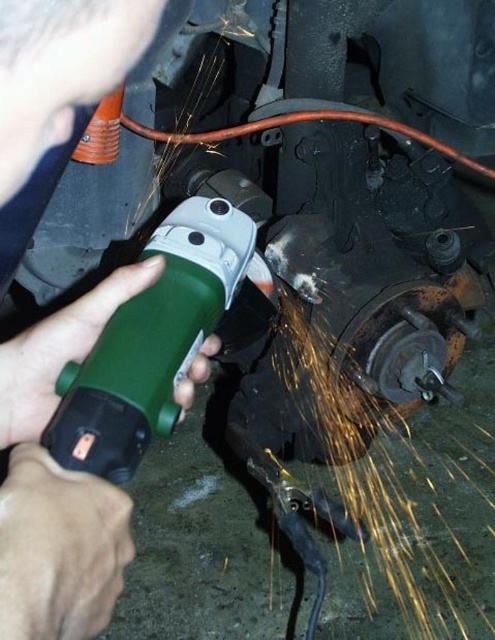
Who is taller, green plastic grinder at center or green plastic angle grinder at center?

Standing taller between the two is green plastic grinder at center.

This screenshot has width=495, height=640. In order to click on green plastic grinder at center in this screenshot , I will do `click(58, 483)`.

Who is more distant from viewer, (16, 428) or (124, 454)?

The point (16, 428) is more distant.

Where is `green plastic grinder at center`? The height and width of the screenshot is (640, 495). green plastic grinder at center is located at coordinates (58, 483).